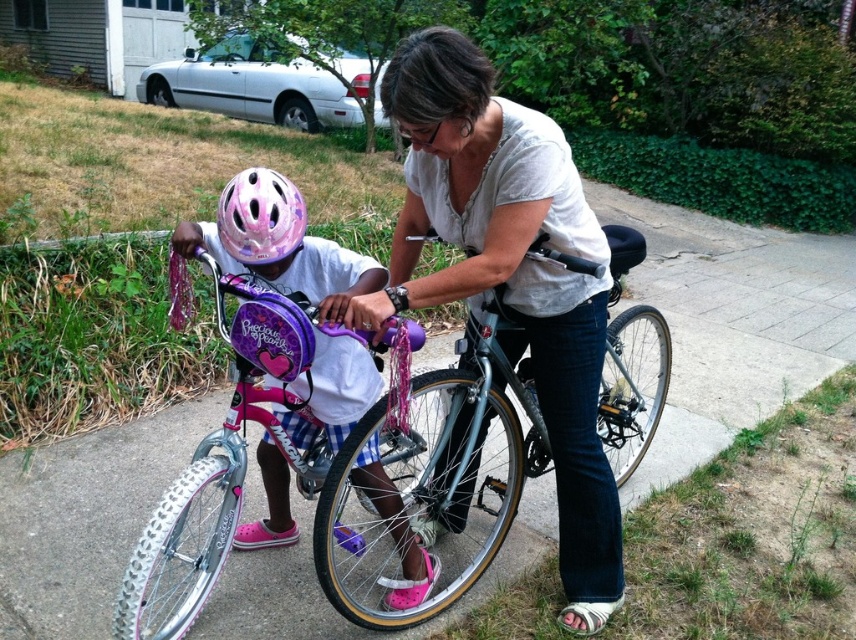
Question: Considering the relative positions of pink matte bicycle at center and pink glossy helmet at left in the image provided, where is pink matte bicycle at center located with respect to pink glossy helmet at left?

Choices:
 (A) below
 (B) above

Answer: (A)

Question: Which object is the closest to the pink glossy helmet at upper center?

Choices:
 (A) pink glossy helmet at left
 (B) matte white shirt at center
 (C) concrete at center
 (D) pink matte bicycle at center

Answer: (A)

Question: Can you confirm if concrete at center is wider than pink glossy helmet at upper center?

Choices:
 (A) no
 (B) yes

Answer: (B)

Question: Among these objects, which one is farthest from the camera?

Choices:
 (A) pink matte bicycle at center
 (B) concrete at center
 (C) pink glossy helmet at left

Answer: (B)

Question: Which object appears closest to the camera in this image?

Choices:
 (A) matte white shirt at center
 (B) pink glossy helmet at left

Answer: (A)

Question: Observing the image, what is the correct spatial positioning of pink matte bicycle at center in reference to pink glossy helmet at left?

Choices:
 (A) below
 (B) above

Answer: (A)